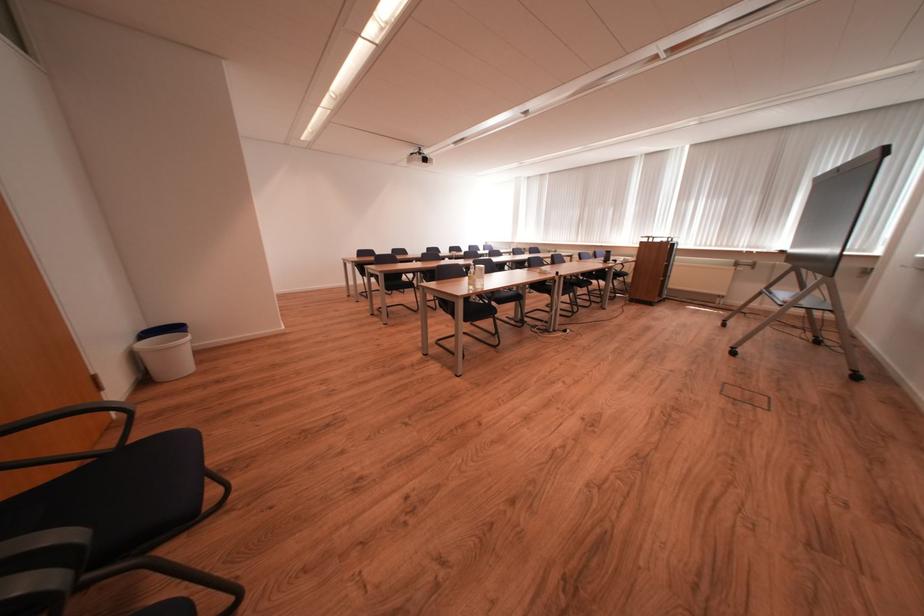
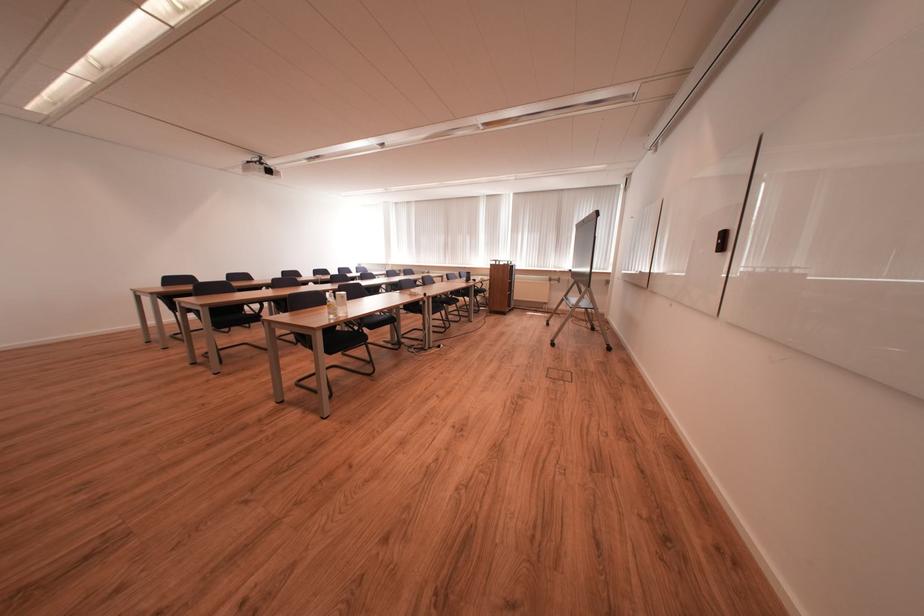
Locate, in the second image, the point that corresponds to [476,302] in the first image.

(337, 331)